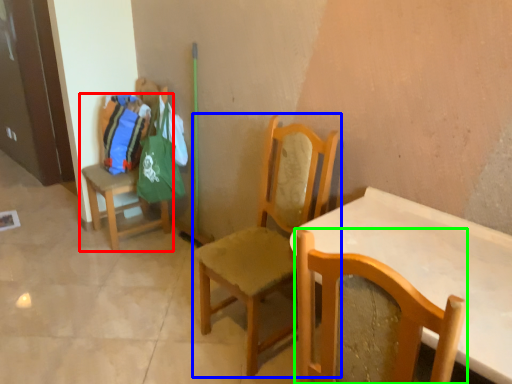
Question: Based on their relative distances, which object is farther from chair (highlighted by a red box)? Choose from chair (highlighted by a blue box) and chair (highlighted by a green box).

Choices:
 (A) chair
 (B) chair

Answer: (B)